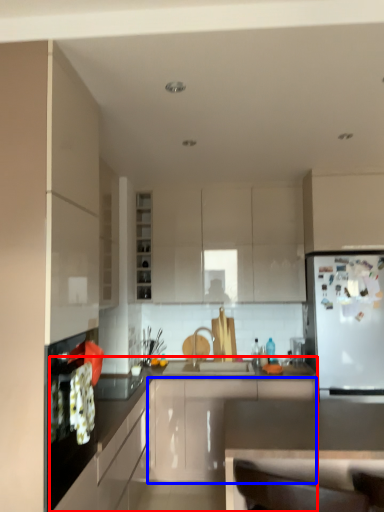
Question: Which point is closer to the camera, countertop (highlighted by a red box) or cabinetry (highlighted by a blue box)?

Choices:
 (A) countertop
 (B) cabinetry

Answer: (A)